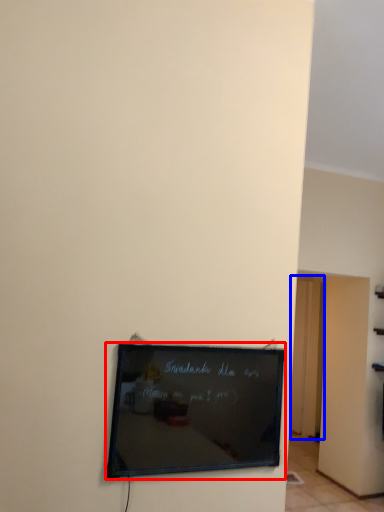
Question: Which object is further to the camera taking this photo, picture frame (highlighted by a red box) or door (highlighted by a blue box)?

Choices:
 (A) picture frame
 (B) door

Answer: (B)